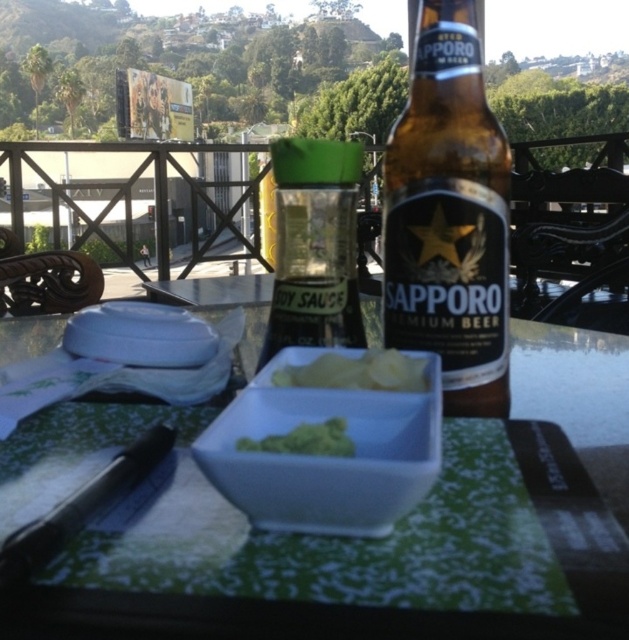
Does point (281, 284) come in front of point (382, 369)?

No.

Between green plastic soy sauce bottle at center and yellow creamy dip at center, which one is positioned lower?

Positioned lower is yellow creamy dip at center.

Identify the location of green plastic soy sauce bottle at center. (314, 244).

Which of these two, brown glass beer bottle at center or yellow creamy dip at center, stands taller?

Standing taller between the two is brown glass beer bottle at center.

Is point (437, 288) positioned after point (291, 378)?

Yes.

Find the location of a particular element. Image resolution: width=629 pixels, height=640 pixels. brown glass beer bottle at center is located at coordinates (448, 211).

Which is in front, point (187, 428) or point (443, 196)?

Point (187, 428) is in front.

Between white glossy table at center and brown glass beer bottle at center, which one appears on the left side from the viewer's perspective?

From the viewer's perspective, white glossy table at center appears more on the left side.

Describe the element at coordinates (335, 538) in the screenshot. This screenshot has width=629, height=640. I see `white glossy table at center` at that location.

Find the location of `white glossy table at center`. white glossy table at center is located at coordinates 335,538.